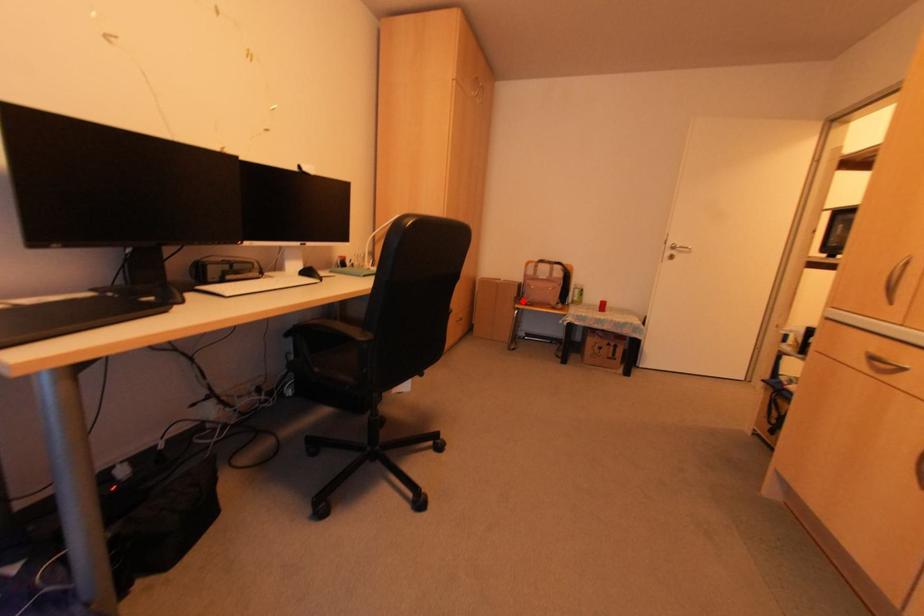
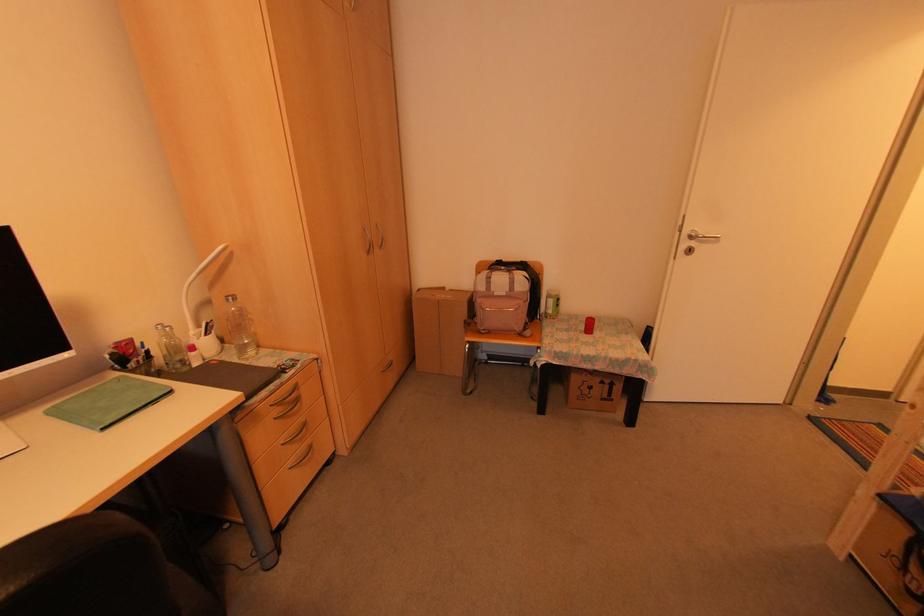
Question: I am providing you with two images of the same scene from different viewpoints. Given a red point in image1, look at the same physical point in image2. Is it:

Choices:
 (A) Closer to the viewpoint
 (B) Farther from the viewpoint

Answer: (B)